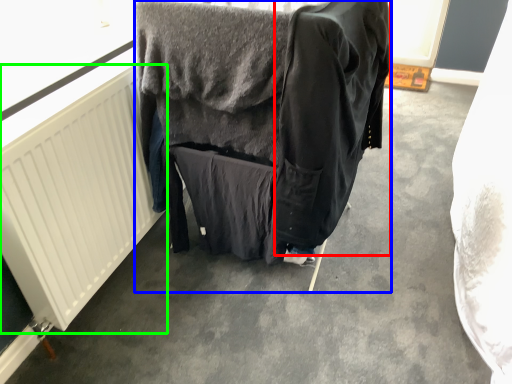
Question: Based on their relative distances, which object is farther from clothing (highlighted by a red box)? Choose from furniture (highlighted by a blue box) and radiator (highlighted by a green box).

Choices:
 (A) furniture
 (B) radiator

Answer: (B)